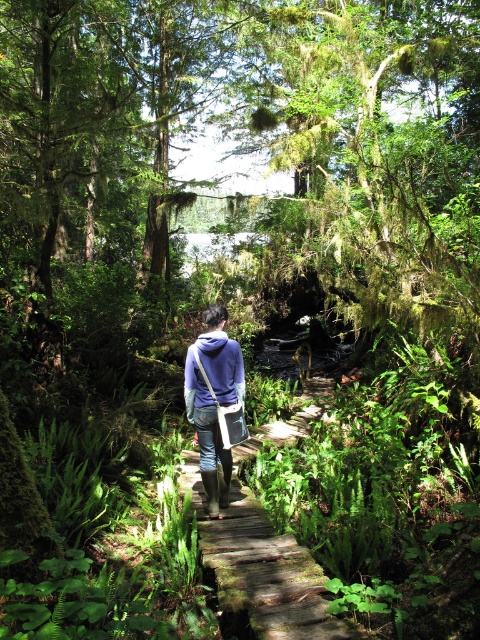
Question: Which object is farther from the camera taking this photo?

Choices:
 (A) wooden at center
 (B) purple matte jacket at center

Answer: (A)

Question: Which point is closer to the camera?

Choices:
 (A) wooden at center
 (B) purple matte jacket at center

Answer: (B)

Question: Is wooden at center bigger than purple matte jacket at center?

Choices:
 (A) no
 (B) yes

Answer: (A)

Question: In this image, where is wooden at center located relative to purple matte jacket at center?

Choices:
 (A) below
 (B) above

Answer: (A)

Question: Considering the relative positions of wooden at center and purple matte jacket at center in the image provided, where is wooden at center located with respect to purple matte jacket at center?

Choices:
 (A) above
 (B) below

Answer: (B)

Question: Which point is closer to the camera?

Choices:
 (A) purple matte jacket at center
 (B) wooden at center

Answer: (A)